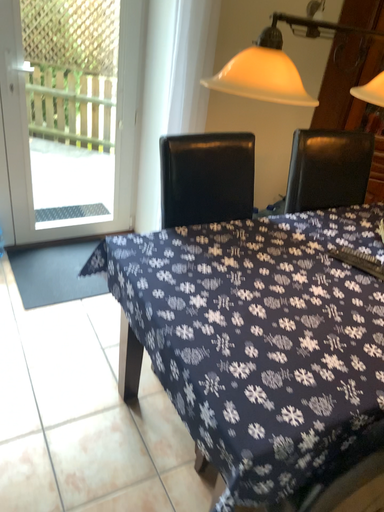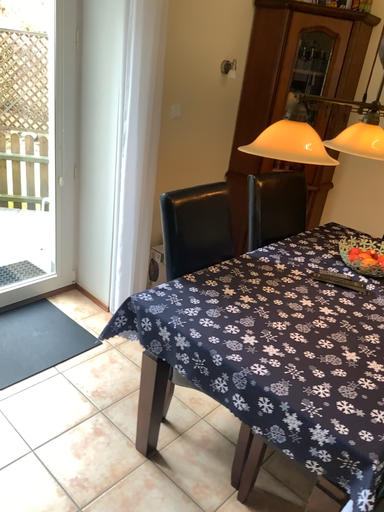
Question: How did the camera likely rotate when shooting the video?

Choices:
 (A) rotated right
 (B) rotated left

Answer: (A)